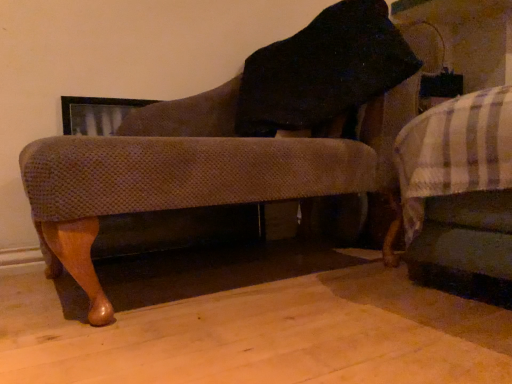
Question: From a real-world perspective, is white striped fabric bed at right above or below textured fabric chair at center?

Choices:
 (A) below
 (B) above

Answer: (A)

Question: Is white striped fabric bed at right in front of or behind textured fabric chair at center in the image?

Choices:
 (A) front
 (B) behind

Answer: (B)

Question: Would you say white striped fabric bed at right is inside or outside textured fabric chair at center?

Choices:
 (A) inside
 (B) outside

Answer: (B)

Question: Based on their sizes in the image, would you say textured fabric chair at center is bigger or smaller than white striped fabric bed at right?

Choices:
 (A) small
 (B) big

Answer: (B)

Question: From a real-world perspective, is textured fabric chair at center above or below white striped fabric bed at right?

Choices:
 (A) above
 (B) below

Answer: (A)

Question: Considering the positions of textured fabric chair at center and white striped fabric bed at right in the image, is textured fabric chair at center wider or thinner than white striped fabric bed at right?

Choices:
 (A) wide
 (B) thin

Answer: (B)

Question: Does point (328, 135) appear closer or farther from the camera than point (494, 198)?

Choices:
 (A) farther
 (B) closer

Answer: (A)